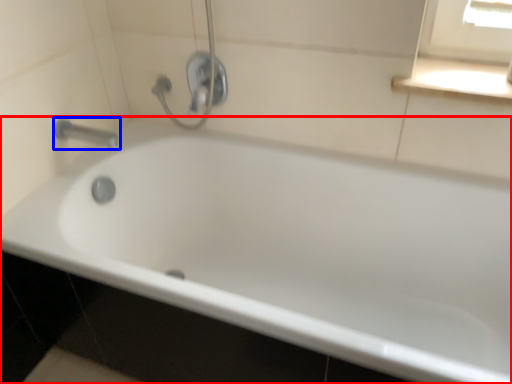
Question: Among these objects, which one is farthest to the camera, bathtub (highlighted by a red box) or tap (highlighted by a blue box)?

Choices:
 (A) bathtub
 (B) tap

Answer: (B)